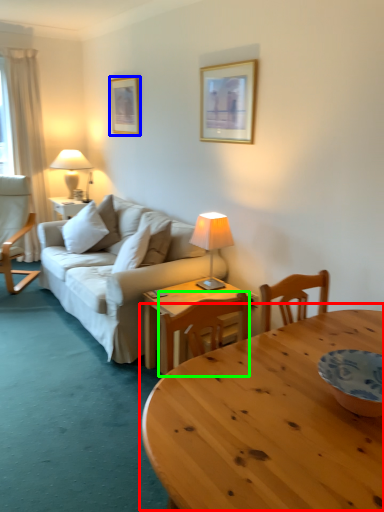
Question: Which object is positioned closest to coffee table (highlighted by a red box)? Select from picture frame (highlighted by a blue box) and chair (highlighted by a green box).

Choices:
 (A) picture frame
 (B) chair

Answer: (B)